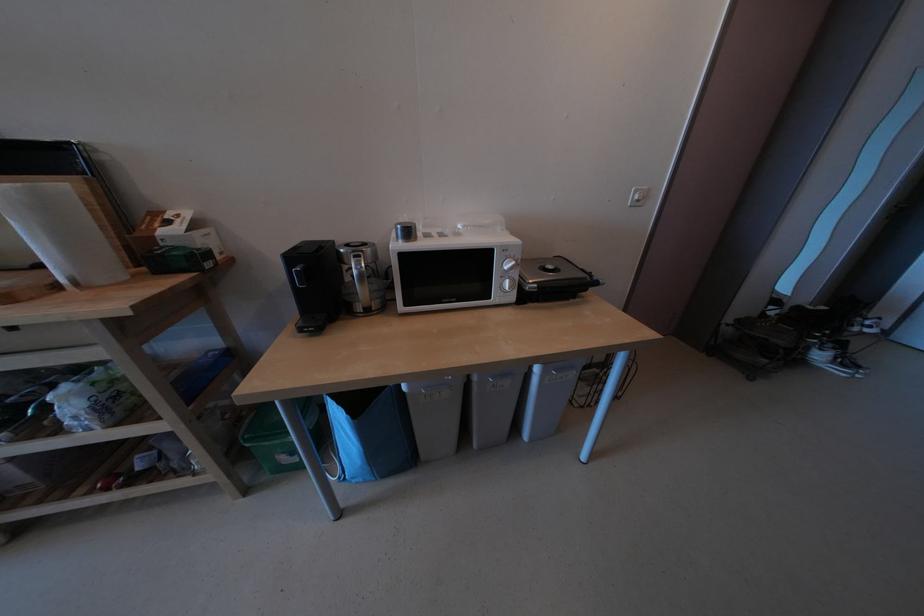
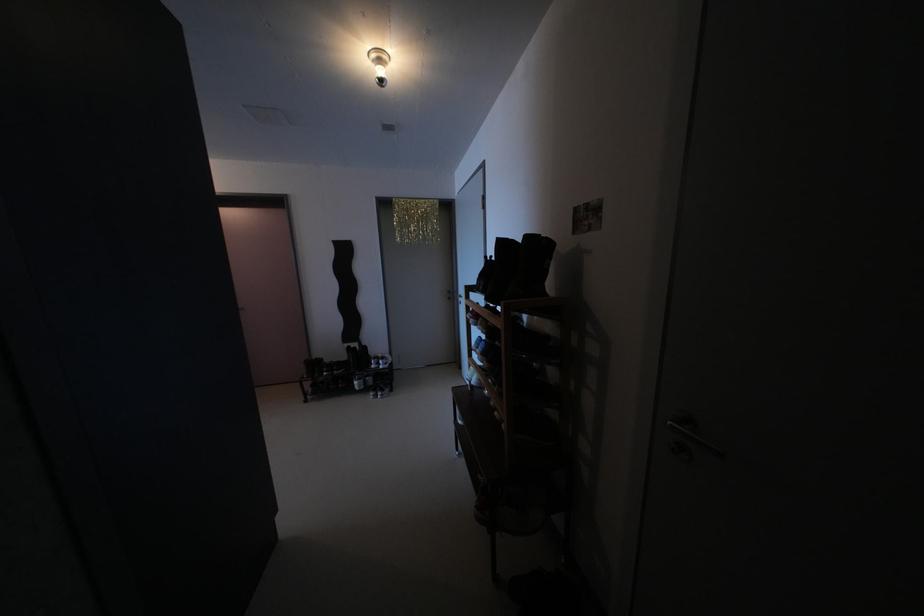
Question: In a continuous first-person perspective shot, in which direction is the camera moving?

Choices:
 (A) Left
 (B) Right
 (C) Forward
 (D) Backward

Answer: (B)